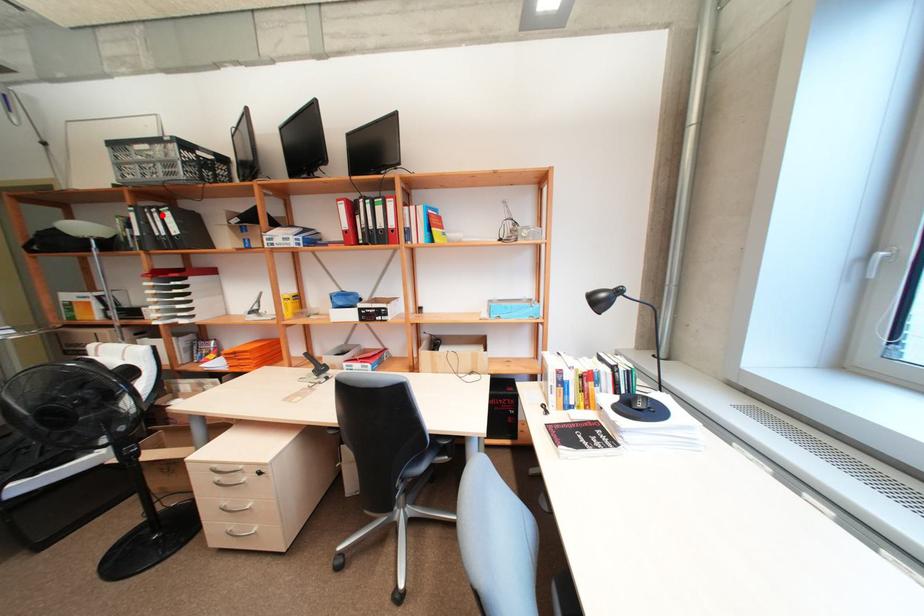
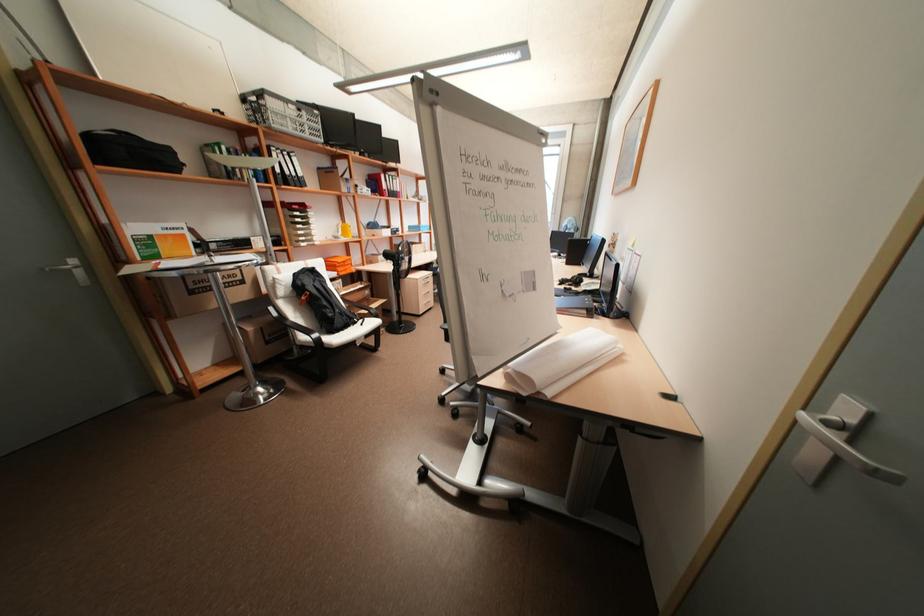
Locate, in the second image, the point that corresponds to the highlighted location in the first image.

(293, 158)